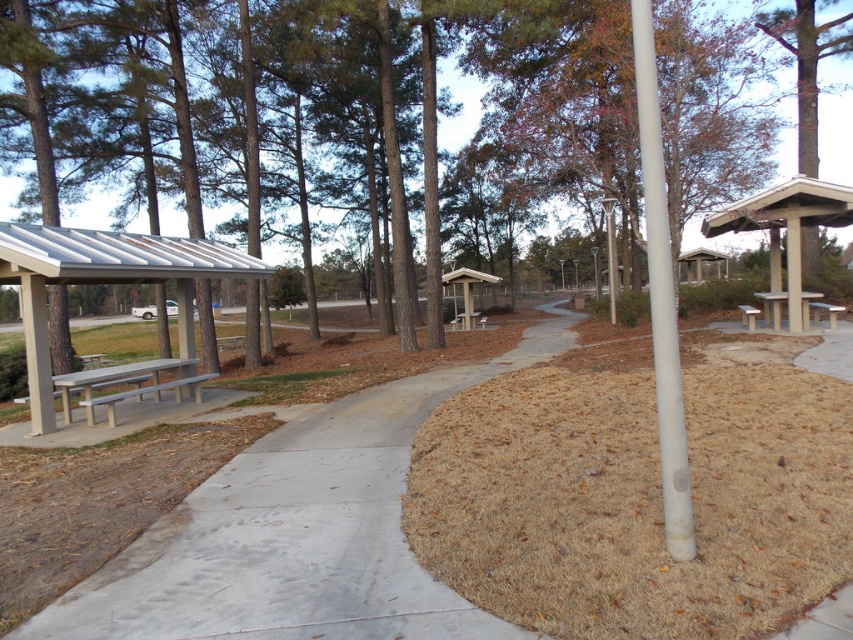
Identify the location of white smooth pole at center. This screenshot has height=640, width=853. (660, 296).

Between point (645, 77) and point (807, 328), which one is positioned behind?

The point (807, 328) is more distant.

Who is more forward, (x=646, y=227) or (x=786, y=298)?

Point (x=646, y=227) is in front.

Where is `white smooth pole at center`? The width and height of the screenshot is (853, 640). white smooth pole at center is located at coordinates (660, 296).

Between wooden bench at upper right and wooden bus stop at center, which one has more height?

wooden bus stop at center

Who is shorter, wooden bench at upper right or wooden bus stop at center?

Standing shorter between the two is wooden bench at upper right.

Which is in front, point (828, 202) or point (459, 280)?

Point (828, 202) is in front.

Find the location of a particular element. This screenshot has width=853, height=640. wooden bench at upper right is located at coordinates (785, 208).

Can you confirm if wooden bus stop at center is positioned to the left of wooden bench at center?

Incorrect, wooden bus stop at center is not on the left side of wooden bench at center.

Who is positioned more to the left, wooden bus stop at center or wooden bench at center?

Positioned to the left is wooden bench at center.

The image size is (853, 640). Describe the element at coordinates (467, 291) in the screenshot. I see `wooden bus stop at center` at that location.

Identify the location of wooden bus stop at center. (467, 291).